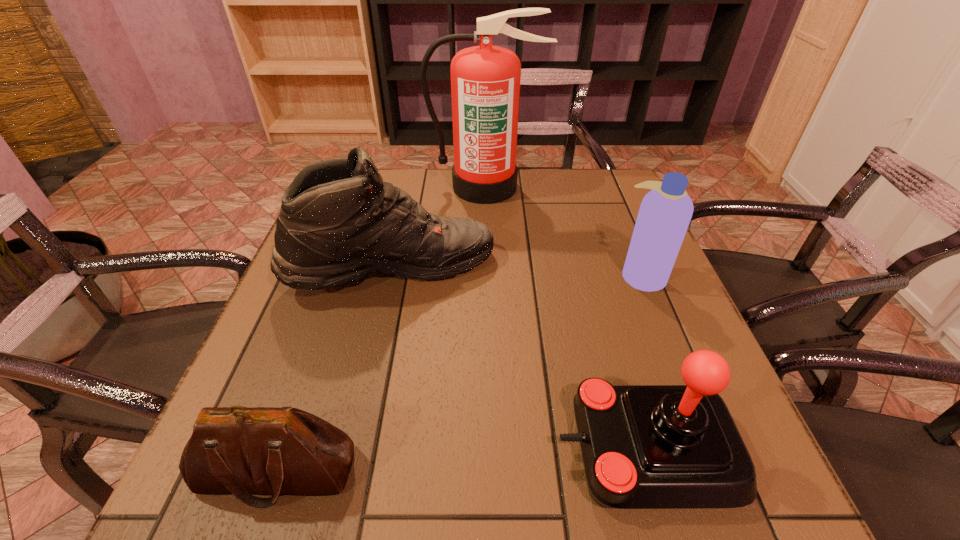
You are a GUI agent. You are given a task and a screenshot of the screen. Output one action in this format:
    pyautogui.click(x=<x>, y=<y>)
    Task: Click on the object present at the near left corner
    
    Given the screenshot: What is the action you would take?
    pyautogui.click(x=236, y=450)

This screenshot has width=960, height=540. In order to click on object that is positioned at the near right corner in this screenshot , I will do `click(643, 446)`.

Locate an element on the screen. Image resolution: width=960 pixels, height=540 pixels. free space at the far edge is located at coordinates (434, 212).

Where is `vacant position at the near edge of the desktop`? The height and width of the screenshot is (540, 960). vacant position at the near edge of the desktop is located at coordinates (483, 503).

At what (x,y) coordinates should I click in order to perform the action: click on free space at the left edge of the desktop. Please return your answer as a coordinate pair (x, y). This screenshot has width=960, height=540. Looking at the image, I should click on [343, 328].

Locate an element on the screen. This screenshot has width=960, height=540. free region at the right edge is located at coordinates (606, 278).

In the image, there is a desktop. Where is `vacant space at the far left corner`? vacant space at the far left corner is located at coordinates (390, 179).

Locate an element on the screen. This screenshot has width=960, height=540. vacant space at the far right corner is located at coordinates (588, 197).

Identify the location of empty location between the shortest object and the shampoo. The height and width of the screenshot is (540, 960). (459, 373).

Identify the location of free area in between the shoulder bag and the ski boot. The height and width of the screenshot is (540, 960). (335, 370).